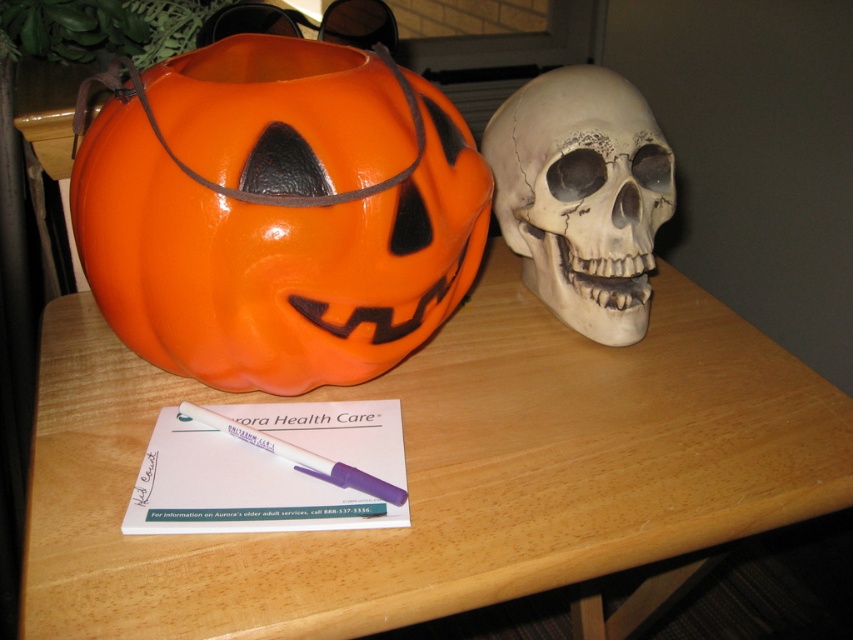
You are standing at the edge of the table and want to place a small candy on the white matte skull at right. What are the coordinates where you should aim to place the candy?

The coordinates for the white matte skull at right are at point (582, 195), so you should aim for that location to place the candy.

You are a student who needs to write a note using the purple plastic pen at center. The note must be written on a surface that is higher than the pen. Can you use the wooden table at center for this task?

The wooden table at center has a greater height compared to the purple plastic pen at center, so yes, you can use the wooden table at center to write the note since it is higher than the pen.